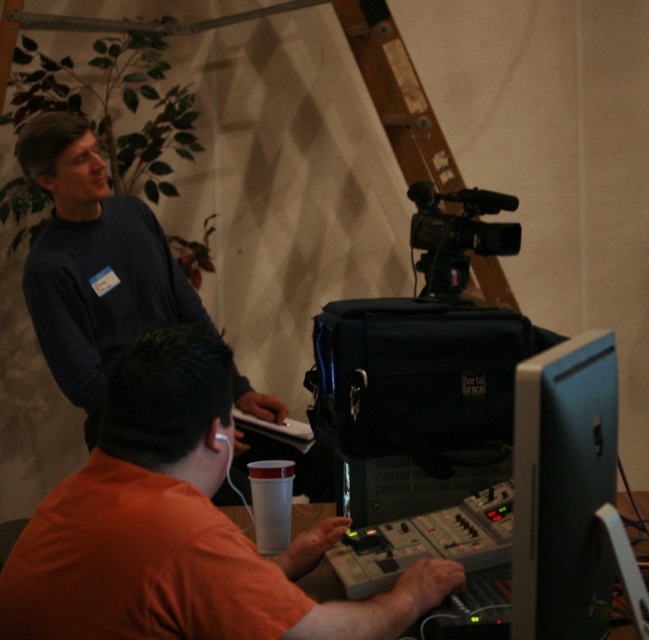
Question: Is dark blue sweater at upper left smaller than matte black monitor at lower right?

Choices:
 (A) no
 (B) yes

Answer: (A)

Question: Which point is farther to the camera?

Choices:
 (A) orange cotton shirt at center
 (B) dark blue sweater at upper left

Answer: (B)

Question: Does dark blue sweater at upper left have a larger size compared to black plastic video camera at upper right?

Choices:
 (A) no
 (B) yes

Answer: (B)

Question: Considering the relative positions of dark blue sweater at upper left and matte black monitor at lower right in the image provided, where is dark blue sweater at upper left located with respect to matte black monitor at lower right?

Choices:
 (A) right
 (B) left

Answer: (B)

Question: Which point is closer to the camera?

Choices:
 (A) dark blue sweater at upper left
 (B) black plastic video camera at upper right

Answer: (B)

Question: Considering the real-world distances, which object is farthest from the matte black monitor at lower right?

Choices:
 (A) orange cotton shirt at center
 (B) dark blue sweater at upper left
 (C) black plastic video camera at upper right

Answer: (B)